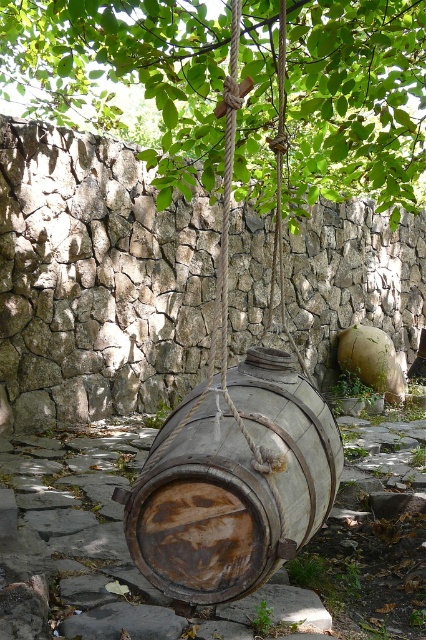
Question: Among these objects, which one is farthest from the camera?

Choices:
 (A) green leafy tree at upper center
 (B) rusty wood barrel at center

Answer: (A)

Question: Does green leafy tree at upper center appear over rusty wood barrel at center?

Choices:
 (A) no
 (B) yes

Answer: (B)

Question: Can you confirm if green leafy tree at upper center is positioned to the right of rusty wood barrel at center?

Choices:
 (A) yes
 (B) no

Answer: (B)

Question: Considering the relative positions of green leafy tree at upper center and rusty wood barrel at center in the image provided, where is green leafy tree at upper center located with respect to rusty wood barrel at center?

Choices:
 (A) below
 (B) above

Answer: (B)